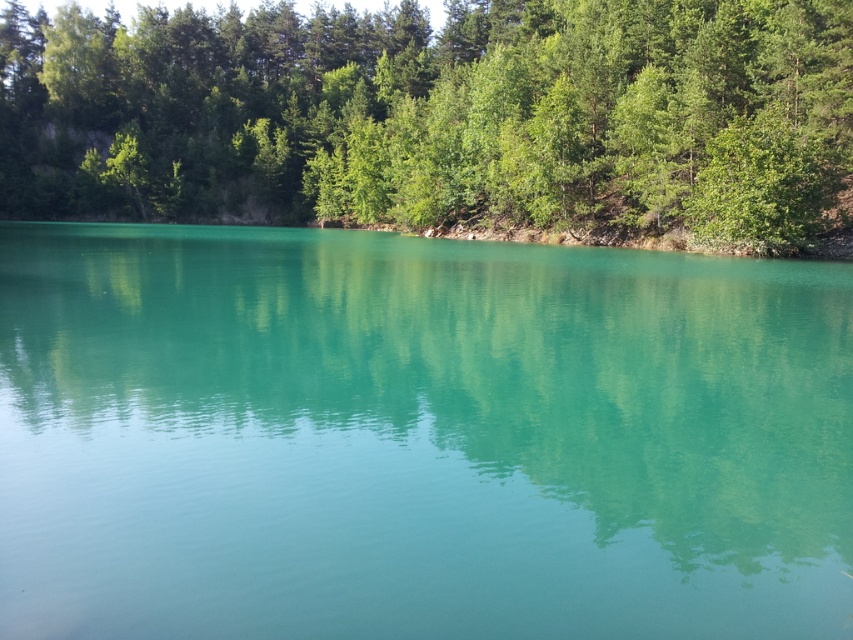
Which of these two, turquoise glossy water at center or green leafy trees at upper center, stands taller?

With more height is green leafy trees at upper center.

Where is `turquoise glossy water at center`? turquoise glossy water at center is located at coordinates (416, 436).

This screenshot has height=640, width=853. Identify the location of turquoise glossy water at center. (416, 436).